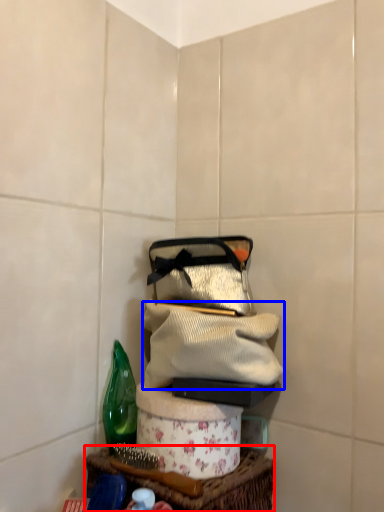
Question: Which object is closer to the camera taking this photo, table (highlighted by a red box) or clothing (highlighted by a blue box)?

Choices:
 (A) table
 (B) clothing

Answer: (A)